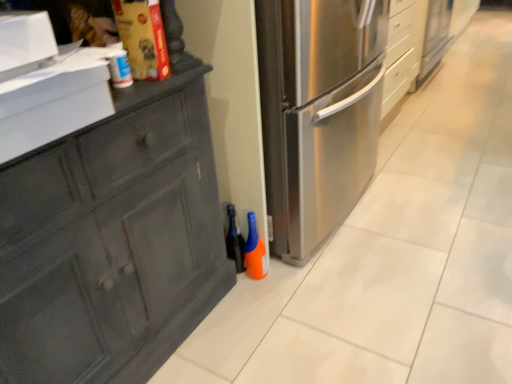
Measure the distance between orange matte bottle at lower center, which ranks as the second bottle in left-to-right order, and camera.

orange matte bottle at lower center, which ranks as the second bottle in left-to-right order, is 5.38 feet away from camera.

At what (x,y) coordinates should I click in order to perform the action: click on orange matte bottle at lower center, which is the first bottle in right-to-left order. Please return your answer as a coordinate pair (x, y). This screenshot has width=512, height=384. Looking at the image, I should click on (255, 251).

The image size is (512, 384). What do you see at coordinates (255, 251) in the screenshot?
I see `orange matte bottle at lower center, which ranks as the second bottle in left-to-right order` at bounding box center [255, 251].

How much space does orange matte bottle at lower center, which is the first bottle in right-to-left order, occupy vertically?

The height of orange matte bottle at lower center, which is the first bottle in right-to-left order, is 11.91 inches.

This screenshot has height=384, width=512. Describe the element at coordinates (234, 240) in the screenshot. I see `translucent orange spray bottle at lower center, the 2th bottle from the right` at that location.

Where is `translucent orange spray bottle at lower center, which is the first bottle from left to right`? translucent orange spray bottle at lower center, which is the first bottle from left to right is located at coordinates [234, 240].

Where is `orange matte bottle at lower center, which ranks as the second bottle in left-to-right order`? Image resolution: width=512 pixels, height=384 pixels. orange matte bottle at lower center, which ranks as the second bottle in left-to-right order is located at coordinates (255, 251).

Can you confirm if orange matte bottle at lower center, which ranks as the second bottle in left-to-right order, is positioned to the left of translucent orange spray bottle at lower center, which is the first bottle from left to right?

Incorrect, orange matte bottle at lower center, which ranks as the second bottle in left-to-right order, is not on the left side of translucent orange spray bottle at lower center, which is the first bottle from left to right.

Is orange matte bottle at lower center, which ranks as the second bottle in left-to-right order, in front of translucent orange spray bottle at lower center, the 2th bottle from the right?

That is True.

Considering the positions of point (249, 223) and point (233, 256), is point (249, 223) closer or farther from the camera than point (233, 256)?

Point (249, 223) is positioned closer to the camera compared to point (233, 256).

From the image's perspective, between orange matte bottle at lower center, which is the first bottle in right-to-left order, and translucent orange spray bottle at lower center, which is the first bottle from left to right, who is located below?

orange matte bottle at lower center, which is the first bottle in right-to-left order.

From a real-world perspective, between orange matte bottle at lower center, which is the first bottle in right-to-left order, and translucent orange spray bottle at lower center, which is the first bottle from left to right, who is vertically higher?

translucent orange spray bottle at lower center, which is the first bottle from left to right.

Which of these two, orange matte bottle at lower center, which is the first bottle in right-to-left order, or translucent orange spray bottle at lower center, which is the first bottle from left to right, is wider?

orange matte bottle at lower center, which is the first bottle in right-to-left order.

From their relative heights in the image, would you say orange matte bottle at lower center, which is the first bottle in right-to-left order, is taller or shorter than translucent orange spray bottle at lower center, the 2th bottle from the right?

In the image, orange matte bottle at lower center, which is the first bottle in right-to-left order, appears to be shorter than translucent orange spray bottle at lower center, the 2th bottle from the right.

Is orange matte bottle at lower center, which ranks as the second bottle in left-to-right order, smaller than translucent orange spray bottle at lower center, which is the first bottle from left to right?

Yes, orange matte bottle at lower center, which ranks as the second bottle in left-to-right order, is smaller than translucent orange spray bottle at lower center, which is the first bottle from left to right.

Is orange matte bottle at lower center, which is the first bottle in right-to-left order, not within translucent orange spray bottle at lower center, which is the first bottle from left to right?

Yes, orange matte bottle at lower center, which is the first bottle in right-to-left order, is outside of translucent orange spray bottle at lower center, which is the first bottle from left to right.

Is orange matte bottle at lower center, which ranks as the second bottle in left-to-right order, not near translucent orange spray bottle at lower center, the 2th bottle from the right?

No, orange matte bottle at lower center, which ranks as the second bottle in left-to-right order, is in close proximity to translucent orange spray bottle at lower center, the 2th bottle from the right.

Is orange matte bottle at lower center, which ranks as the second bottle in left-to-right order, oriented away from translucent orange spray bottle at lower center, which is the first bottle from left to right?

Yes.

Could you measure the distance between orange matte bottle at lower center, which ranks as the second bottle in left-to-right order, and translucent orange spray bottle at lower center, which is the first bottle from left to right?

orange matte bottle at lower center, which ranks as the second bottle in left-to-right order, is 2.85 inches from translucent orange spray bottle at lower center, which is the first bottle from left to right.

The image size is (512, 384). I want to click on bottle on the right of translucent orange spray bottle at lower center, the 2th bottle from the right, so click(255, 251).

Which is more to the right, translucent orange spray bottle at lower center, the 2th bottle from the right, or orange matte bottle at lower center, which is the first bottle in right-to-left order?

Positioned to the right is orange matte bottle at lower center, which is the first bottle in right-to-left order.

Is the depth of translucent orange spray bottle at lower center, the 2th bottle from the right, less than that of orange matte bottle at lower center, which is the first bottle in right-to-left order?

No, it is not.

Is point (231, 238) closer or farther from the camera than point (256, 270)?

Point (231, 238) appears to be farther away from the viewer than point (256, 270).

From the image's perspective, does translucent orange spray bottle at lower center, the 2th bottle from the right, appear lower than orange matte bottle at lower center, which ranks as the second bottle in left-to-right order?

Incorrect, from the image's perspective, translucent orange spray bottle at lower center, the 2th bottle from the right, is higher than orange matte bottle at lower center, which ranks as the second bottle in left-to-right order.

From a real-world perspective, is translucent orange spray bottle at lower center, which is the first bottle from left to right, physically below orange matte bottle at lower center, which is the first bottle in right-to-left order?

No.

Is translucent orange spray bottle at lower center, which is the first bottle from left to right, wider or thinner than orange matte bottle at lower center, which is the first bottle in right-to-left order?

Considering their sizes, translucent orange spray bottle at lower center, which is the first bottle from left to right, looks slimmer than orange matte bottle at lower center, which is the first bottle in right-to-left order.

Considering the relative sizes of translucent orange spray bottle at lower center, the 2th bottle from the right, and orange matte bottle at lower center, which ranks as the second bottle in left-to-right order, in the image provided, is translucent orange spray bottle at lower center, the 2th bottle from the right, taller than orange matte bottle at lower center, which ranks as the second bottle in left-to-right order,?

Correct, translucent orange spray bottle at lower center, the 2th bottle from the right, is much taller as orange matte bottle at lower center, which ranks as the second bottle in left-to-right order.

Considering the sizes of translucent orange spray bottle at lower center, which is the first bottle from left to right, and orange matte bottle at lower center, which ranks as the second bottle in left-to-right order, in the image, is translucent orange spray bottle at lower center, which is the first bottle from left to right, bigger or smaller than orange matte bottle at lower center, which ranks as the second bottle in left-to-right order,?

In the image, translucent orange spray bottle at lower center, which is the first bottle from left to right, appears to be larger than orange matte bottle at lower center, which ranks as the second bottle in left-to-right order.

Does translucent orange spray bottle at lower center, which is the first bottle from left to right, contain orange matte bottle at lower center, which ranks as the second bottle in left-to-right order?

That's incorrect, orange matte bottle at lower center, which ranks as the second bottle in left-to-right order, is not inside translucent orange spray bottle at lower center, which is the first bottle from left to right.

Can you see translucent orange spray bottle at lower center, which is the first bottle from left to right, touching orange matte bottle at lower center, which ranks as the second bottle in left-to-right order?

Absolutely, translucent orange spray bottle at lower center, which is the first bottle from left to right, is next to and touching orange matte bottle at lower center, which ranks as the second bottle in left-to-right order.

Is translucent orange spray bottle at lower center, the 2th bottle from the right, turned away from orange matte bottle at lower center, which is the first bottle in right-to-left order?

Yes, translucent orange spray bottle at lower center, the 2th bottle from the right, is positioned with its back facing orange matte bottle at lower center, which is the first bottle in right-to-left order.

Locate an element on the screen. bottle lying on the left of orange matte bottle at lower center, which ranks as the second bottle in left-to-right order is located at coordinates (234, 240).

At what (x,y) coordinates should I click in order to perform the action: click on bottle on the right of translucent orange spray bottle at lower center, which is the first bottle from left to right. Please return your answer as a coordinate pair (x, y). Looking at the image, I should click on (255, 251).

Where is `bottle behind the orange matte bottle at lower center, which ranks as the second bottle in left-to-right order`? The height and width of the screenshot is (384, 512). bottle behind the orange matte bottle at lower center, which ranks as the second bottle in left-to-right order is located at coordinates (234, 240).